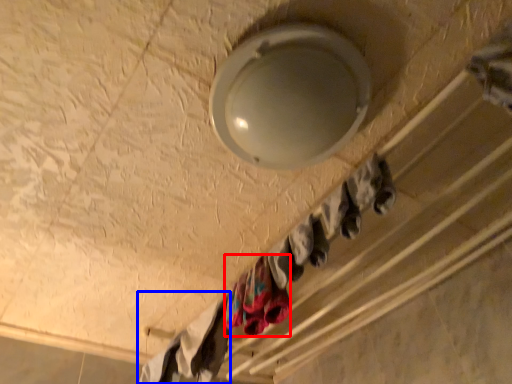
Question: Which of the following is the farthest to the observer, clothing (highlighted by a red box) or clothing (highlighted by a blue box)?

Choices:
 (A) clothing
 (B) clothing

Answer: (B)